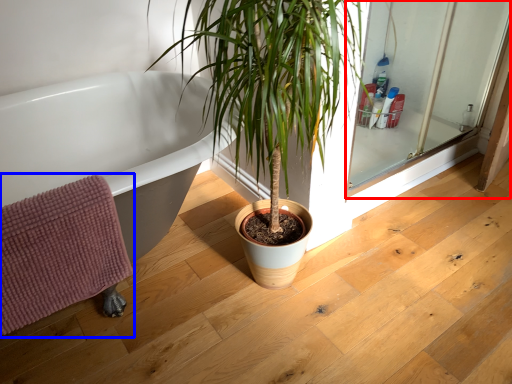
Question: Which object appears closest to the camera in this image, screen door (highlighted by a red box) or bath towel (highlighted by a blue box)?

Choices:
 (A) screen door
 (B) bath towel

Answer: (B)